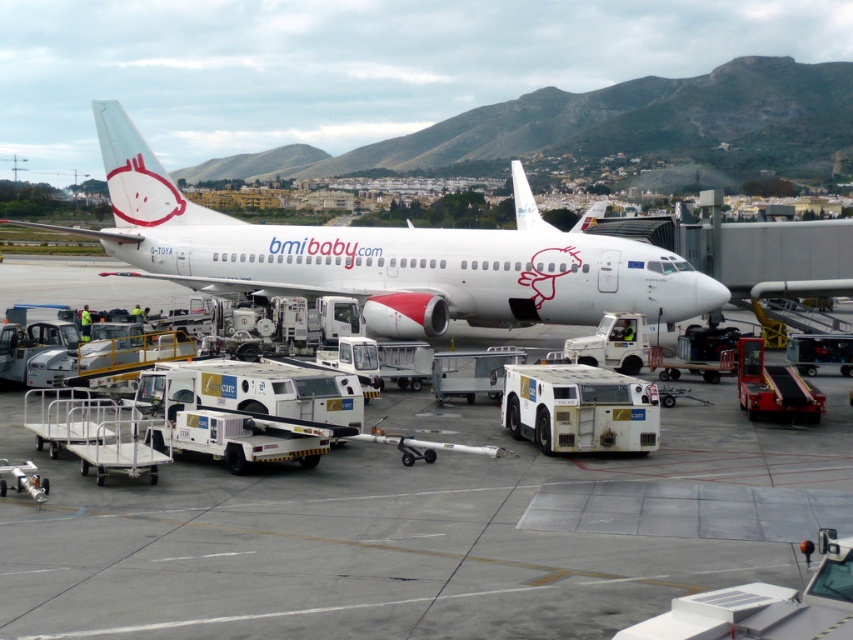
Question: Is white rubber tarmac at center above white matte airplane at center?

Choices:
 (A) no
 (B) yes

Answer: (A)

Question: Is white rubber tarmac at center positioned before white matte airplane at center?

Choices:
 (A) yes
 (B) no

Answer: (A)

Question: Where is white rubber tarmac at center located in relation to white matte airplane at center in the image?

Choices:
 (A) above
 (B) below

Answer: (B)